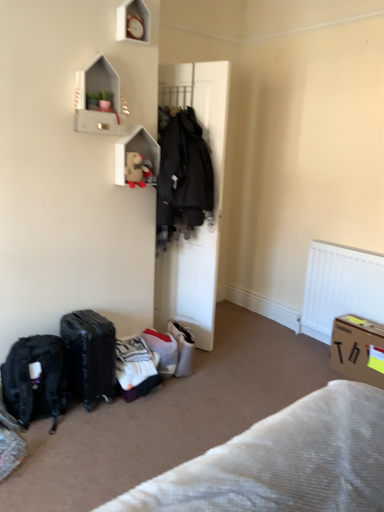
Find the location of a particular element. Image resolution: width=384 pixels, height=512 pixels. free space that is in between cardboard box at lower right and black matte suitcase at lower left is located at coordinates (242, 386).